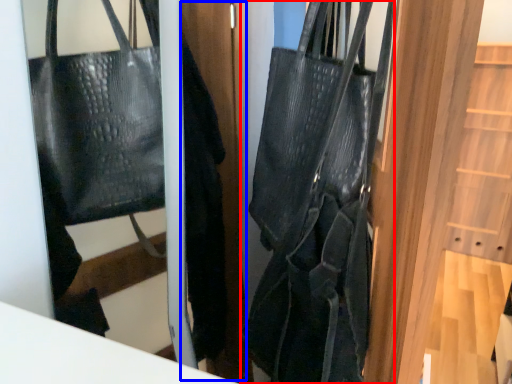
Question: Which object appears farthest to the camera in this image, handbag (highlighted by a red box) or door (highlighted by a blue box)?

Choices:
 (A) handbag
 (B) door

Answer: (B)